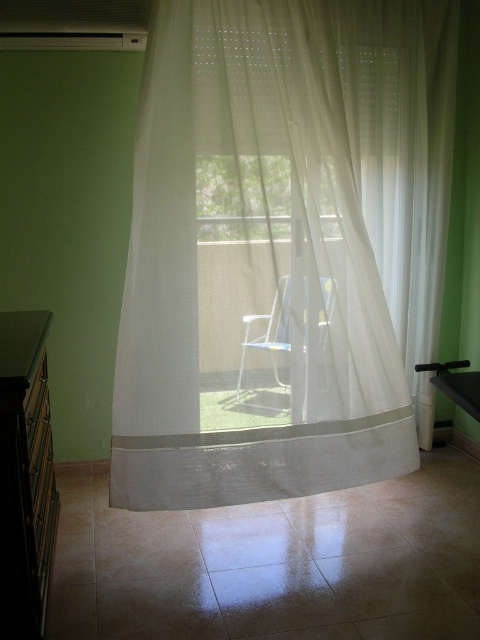
Does transparent fabric window at center have a lesser height compared to white mesh chair at center?

Yes, transparent fabric window at center is shorter than white mesh chair at center.

Where is `transparent fabric window at center`? The width and height of the screenshot is (480, 640). transparent fabric window at center is located at coordinates (242, 196).

Is matte black dresser at left shorter than white mesh chair at center?

No.

Who is shorter, matte black dresser at left or white mesh chair at center?

With less height is white mesh chair at center.

Does point (1, 541) lie behind point (244, 404)?

No, (1, 541) is in front of (244, 404).

In order to click on matte black dresser at left in this screenshot , I will do `click(24, 474)`.

Does white sheer curtain at center come behind transparent fabric window at center?

No, white sheer curtain at center is in front of transparent fabric window at center.

Locate an element on the screen. white sheer curtain at center is located at coordinates (283, 244).

Identify the location of white sheer curtain at center. tap(283, 244).